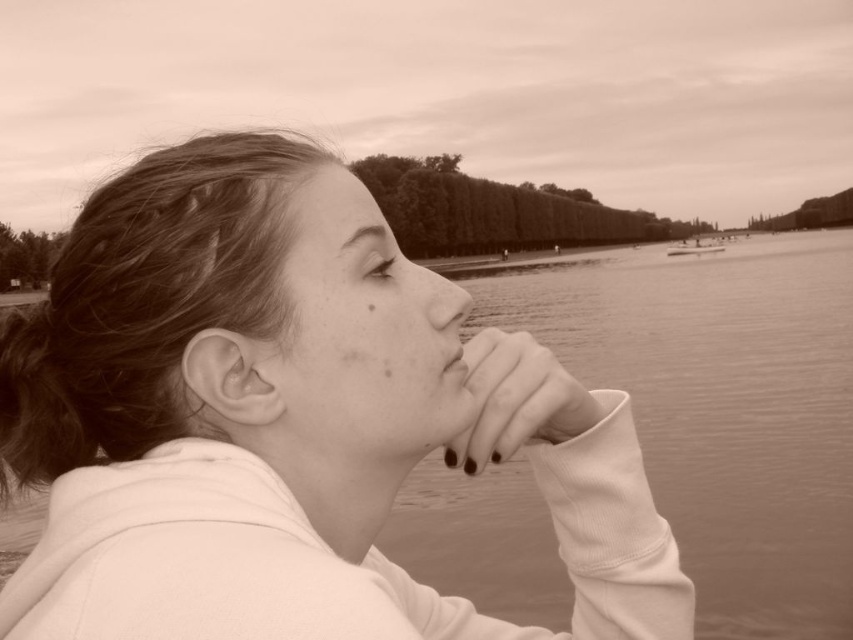
You are designing a poster and need to know which area is wider between the sepia water at center and the smooth skin at lower center. Which one is wider?

The sepia water at center is wider than the smooth skin at lower center according to the description.